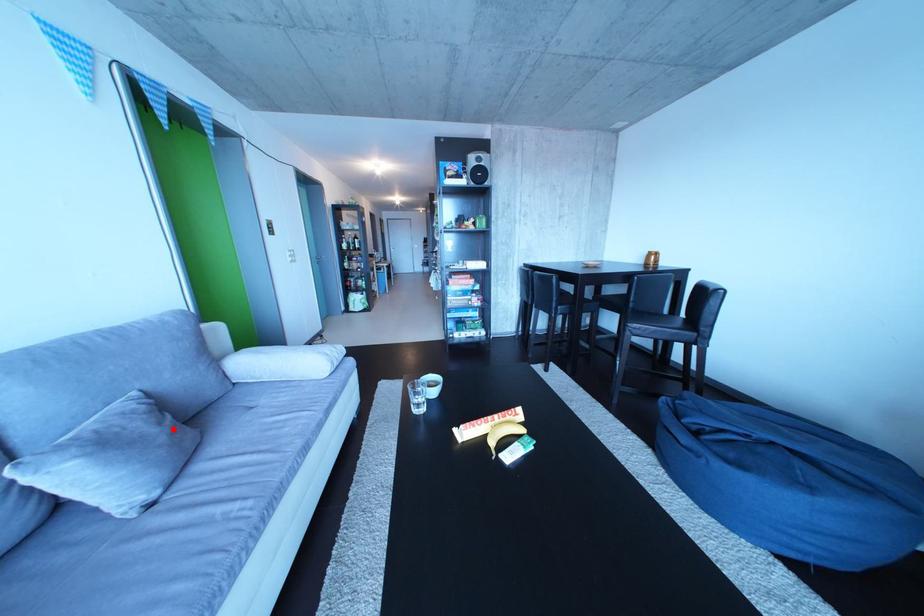
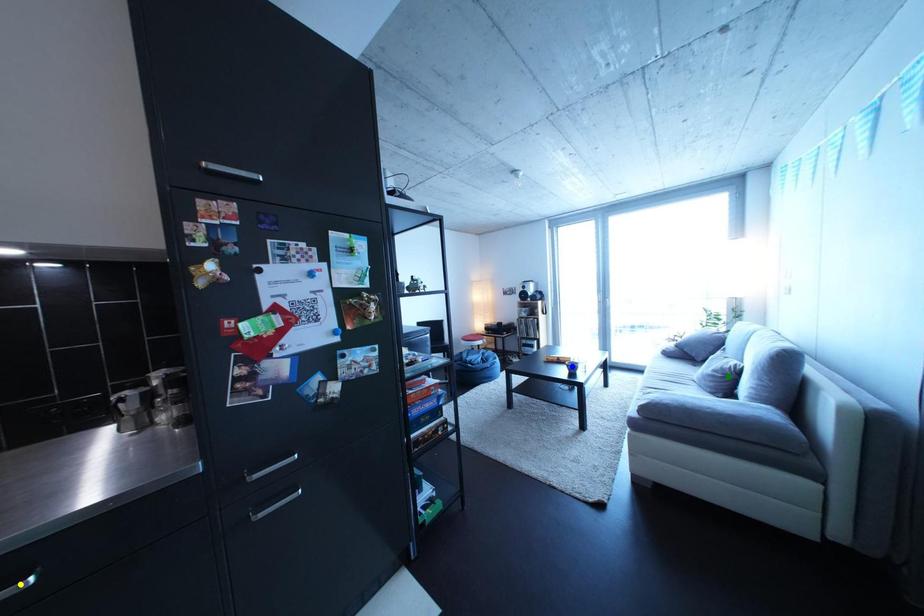
Question: I am providing you with two images of the same scene from different viewpoints. A red point is marked on the first image. You are given multiple points on the second image. Which mark in image 2 goes with the point in image 1?

Choices:
 (A) yellow point
 (B) blue point
 (C) green point

Answer: (C)